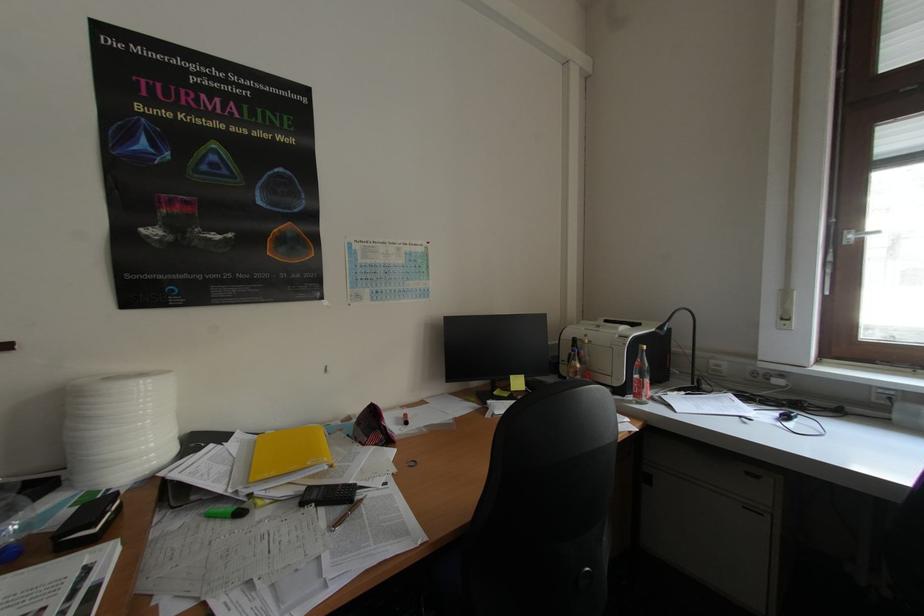
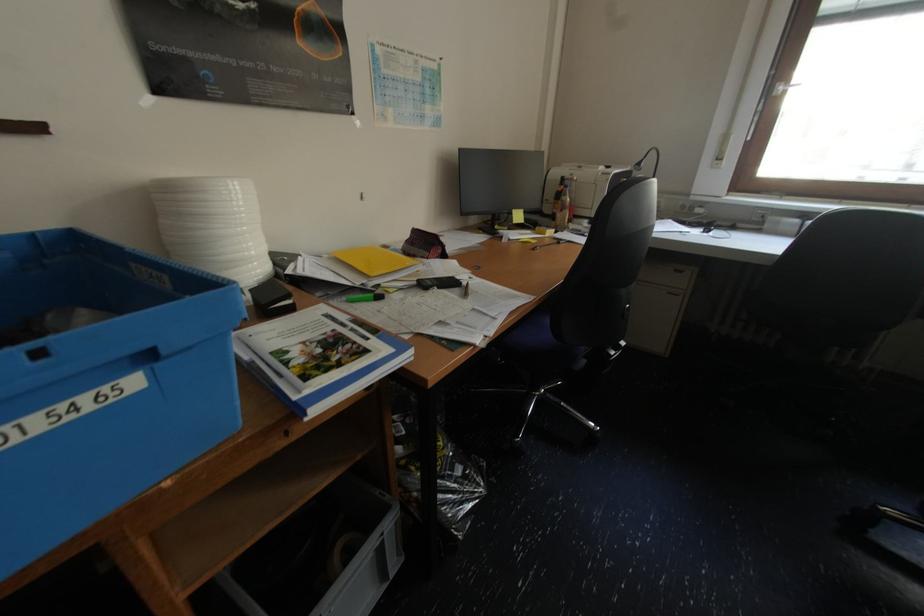
In the second image, find the point that corresponds to point 156,382 in the first image.

(246, 184)